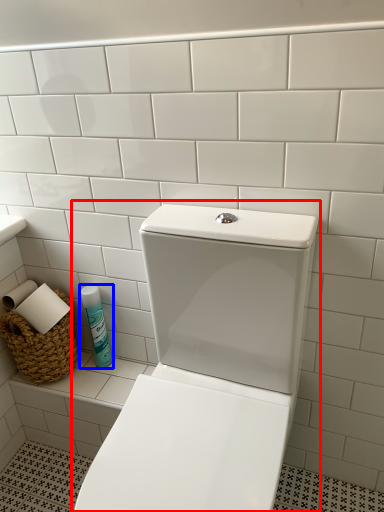
Question: Among these objects, which one is nearest to the camera, toilet (highlighted by a red box) or cleaning product (highlighted by a blue box)?

Choices:
 (A) toilet
 (B) cleaning product

Answer: (A)